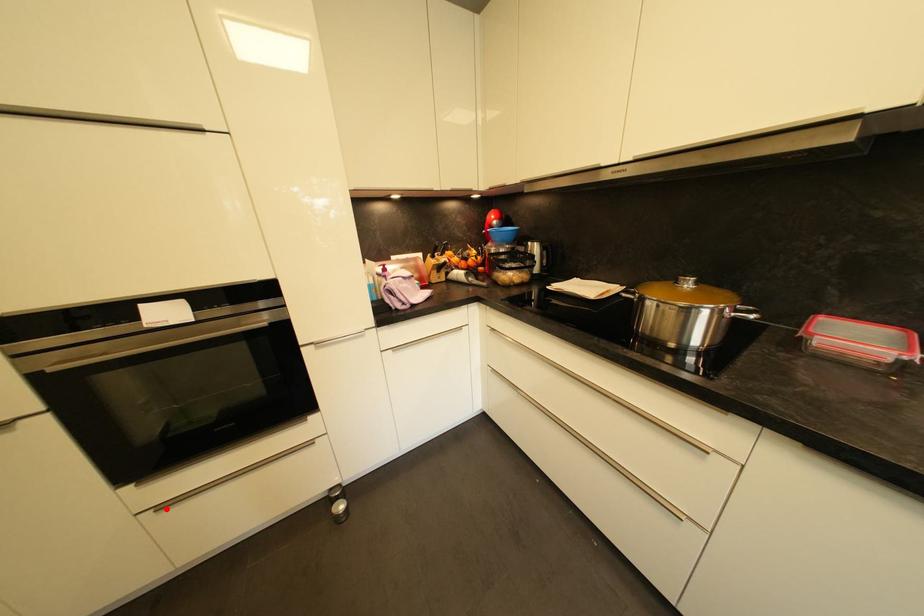
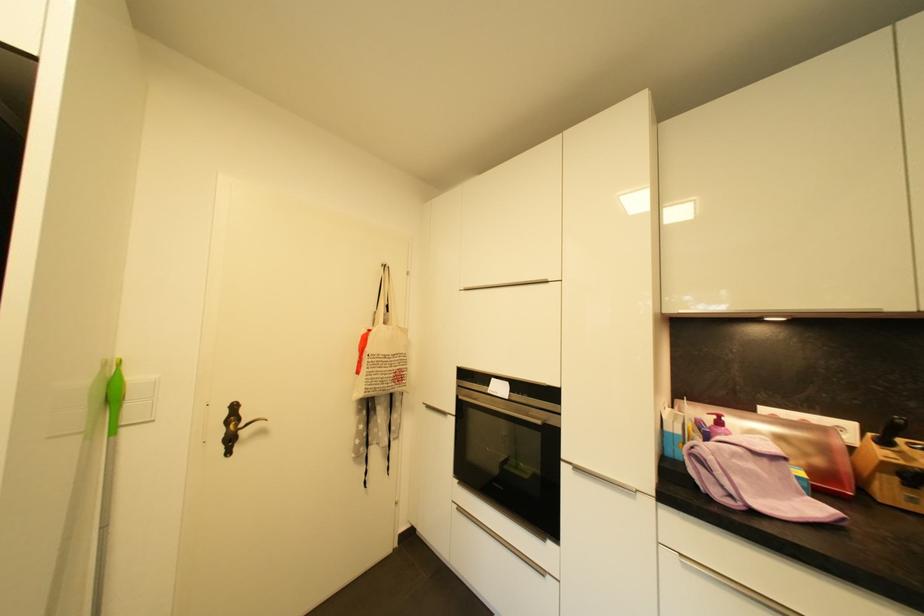
Question: I am providing you with two images of the same scene from different viewpoints. A red point is shown in image1. For the corresponding object point in image2, is it positioned nearer or farther from the camera?

Choices:
 (A) Nearer
 (B) Farther

Answer: (B)